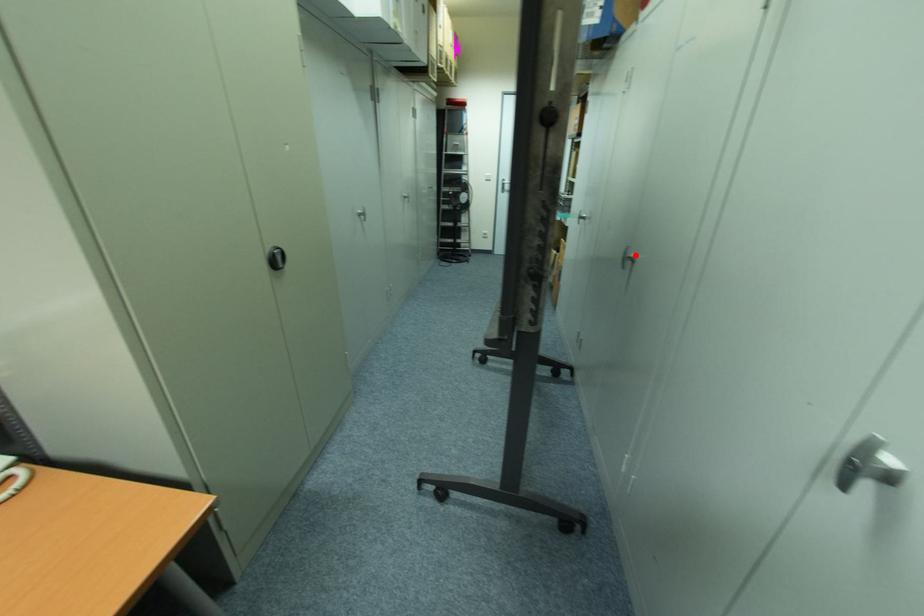
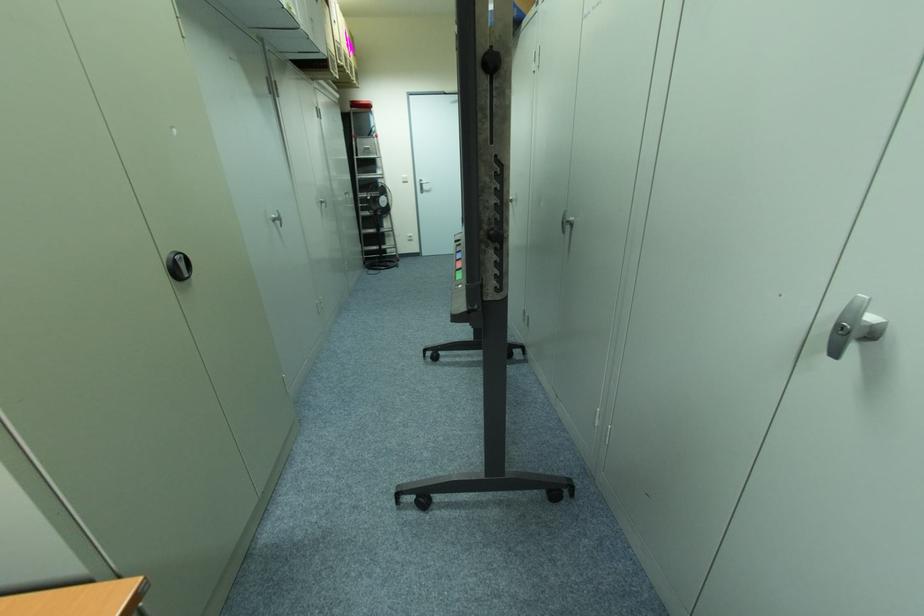
The point at the highlighted location is marked in the first image. Where is the corresponding point in the second image?

(572, 219)